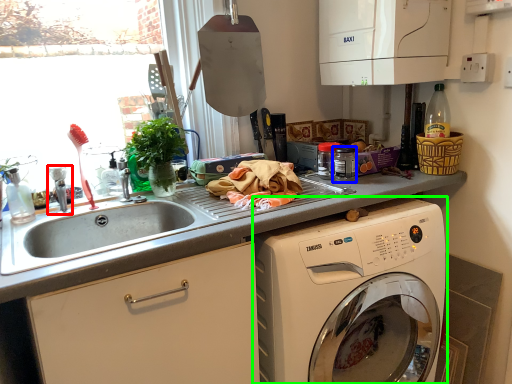
Question: Estimate the real-world distances between objects in this image. Which object is farther from faucet (highlighted by a red box), appliance (highlighted by a blue box) or washing machine (highlighted by a green box)?

Choices:
 (A) appliance
 (B) washing machine

Answer: (B)